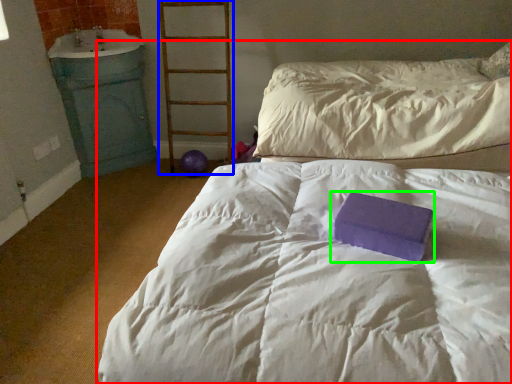
Question: Estimate the real-world distances between objects in this image. Which object is farther from bed (highlighted by a red box), ladder (highlighted by a blue box) or paperback book (highlighted by a green box)?

Choices:
 (A) ladder
 (B) paperback book

Answer: (A)